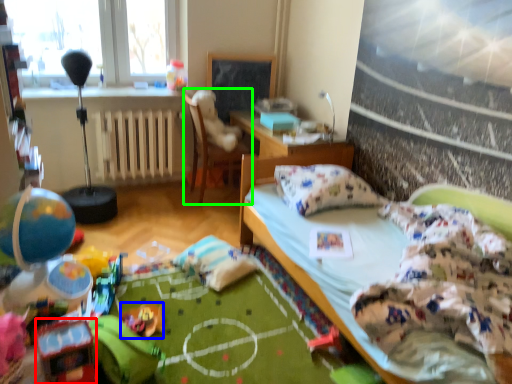
Question: Estimate the real-world distances between objects in this image. Which object is closer to toy (highlighted by a red box), toy (highlighted by a blue box) or chair (highlighted by a green box)?

Choices:
 (A) toy
 (B) chair

Answer: (A)